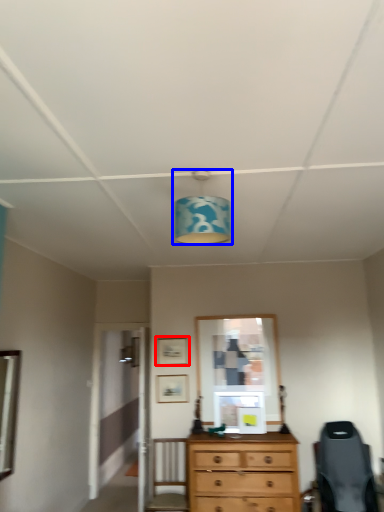
Question: Among these objects, which one is farthest to the camera, picture frame (highlighted by a red box) or light fixture (highlighted by a blue box)?

Choices:
 (A) picture frame
 (B) light fixture

Answer: (A)